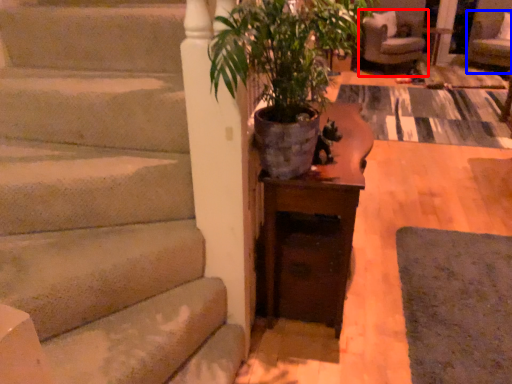
Question: Which of the following is the farthest to the observer, chair (highlighted by a red box) or armchair (highlighted by a blue box)?

Choices:
 (A) chair
 (B) armchair

Answer: (A)